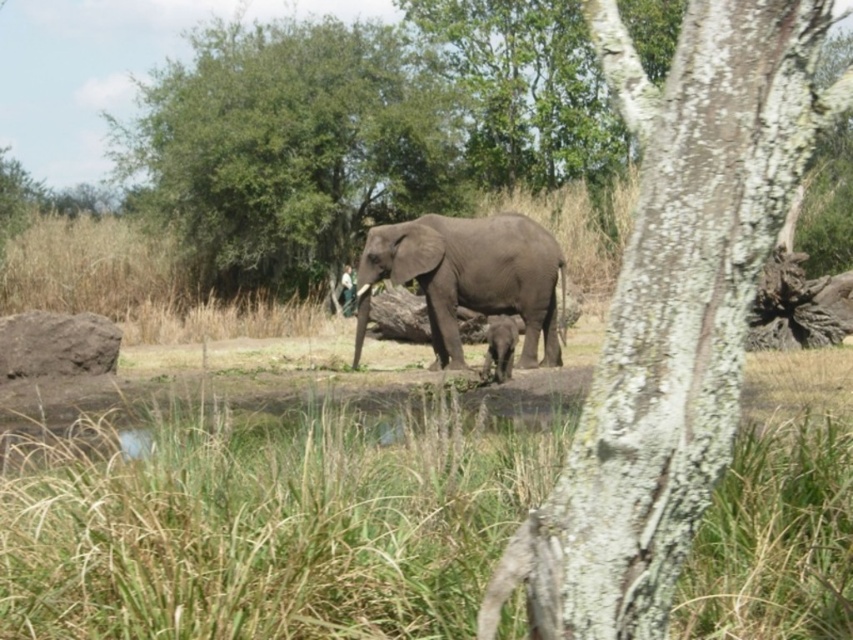
Question: Which of the following is the closest to the observer?

Choices:
 (A) green leafy tree at center
 (B) gray matte elephant at center

Answer: (B)

Question: Is the position of gray rough bark tree trunk at center less distant than that of gray matte elephant at center?

Choices:
 (A) yes
 (B) no

Answer: (A)

Question: Can you confirm if green leafy tree at center is bigger than gray matte elephant at center?

Choices:
 (A) yes
 (B) no

Answer: (A)

Question: Which of these objects is positioned closest to the gray matte elephant at center?

Choices:
 (A) gray rough bark tree trunk at center
 (B) green leafy tree at center
 (C) gray matte baby elephant at center

Answer: (C)

Question: Does gray rough bark tree trunk at center have a lesser width compared to gray matte elephant at center?

Choices:
 (A) yes
 (B) no

Answer: (A)

Question: Which object is the farthest from the gray rough bark tree trunk at center?

Choices:
 (A) green leafy tree at center
 (B) gray matte elephant at center
 (C) gray matte baby elephant at center

Answer: (A)